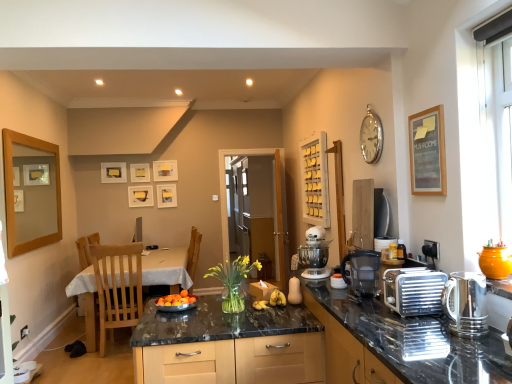
Find the location of a particular element. blank area to the left of sleek metallic kettle at right, acting as the second kitchen appliance starting from the back is located at coordinates (421, 333).